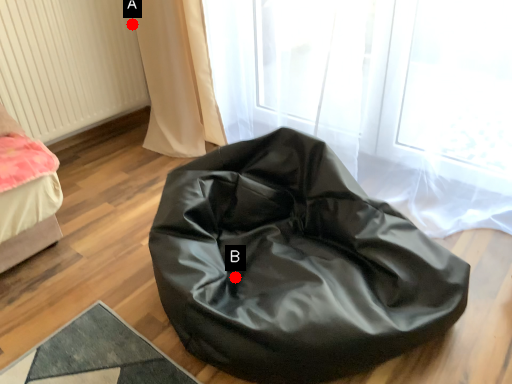
Question: Two points are circled on the image, labeled by A and B beside each circle. Which point is farther to the camera?

Choices:
 (A) A is further
 (B) B is further

Answer: (A)